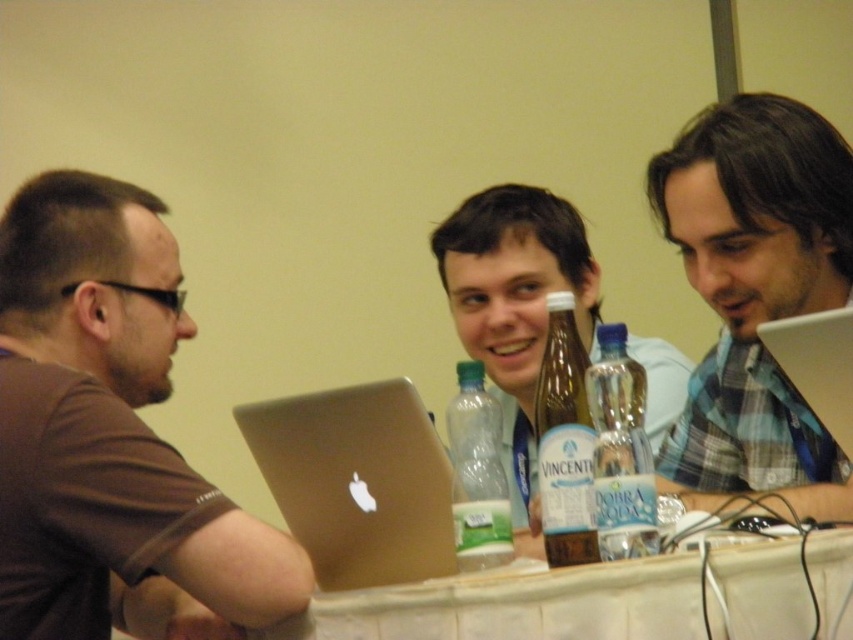
Can you confirm if satin gold laptop at center is bigger than translucent glass bottle at center?

Correct, satin gold laptop at center is larger in size than translucent glass bottle at center.

The image size is (853, 640). Describe the element at coordinates (357, 481) in the screenshot. I see `satin gold laptop at center` at that location.

Does point (262, 454) lie in front of point (546, 435)?

That is False.

The height and width of the screenshot is (640, 853). Find the location of `satin gold laptop at center`. satin gold laptop at center is located at coordinates (357, 481).

Is plaid shirt at center thinner than silver metallic laptop at right?

No.

Between plaid shirt at center and silver metallic laptop at right, which one is positioned higher?

plaid shirt at center is higher up.

At what (x,y) coordinates should I click in order to perform the action: click on plaid shirt at center. Please return your answer as a coordinate pair (x, y). Image resolution: width=853 pixels, height=640 pixels. Looking at the image, I should click on (755, 300).

Does plaid shirt at center have a larger size compared to matte plastic bottle at center?

No.

Looking at this image, does plaid shirt at center have a greater height compared to matte plastic bottle at center?

No, plaid shirt at center is not taller than matte plastic bottle at center.

Which is in front, point (781, 492) or point (524, 467)?

Point (781, 492)

The image size is (853, 640). What are the coordinates of `plaid shirt at center` in the screenshot? It's located at (755, 300).